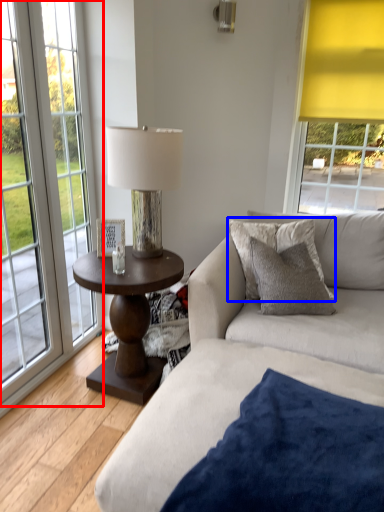
Question: Which point is closer to the camera, window (highlighted by a red box) or pillow (highlighted by a blue box)?

Choices:
 (A) window
 (B) pillow

Answer: (A)